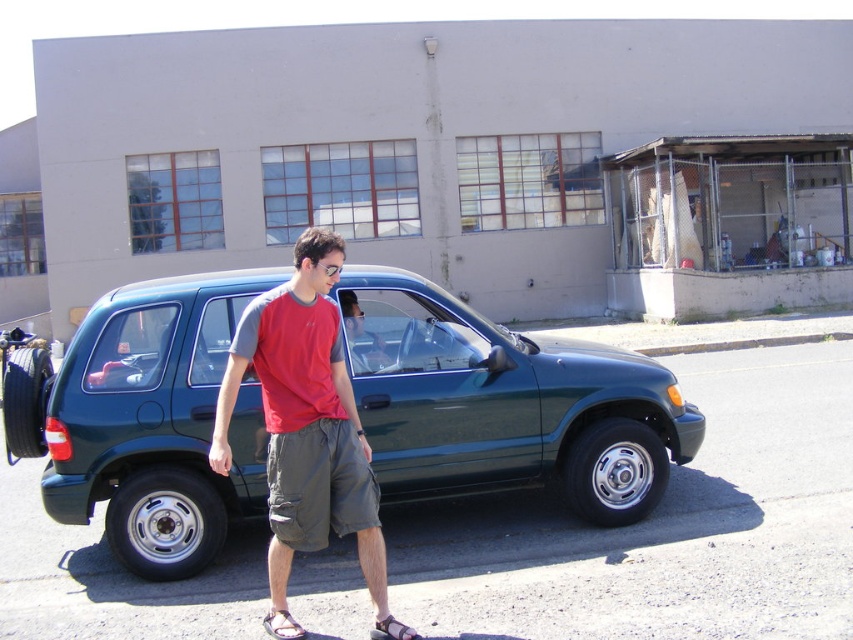
Measure the distance between purple fabric sandal at lower center and camera.

4.02 meters

Can you confirm if purple fabric sandal at lower center is bigger than brown leather sandal at lower center?

Indeed, purple fabric sandal at lower center has a larger size compared to brown leather sandal at lower center.

Who is more forward, (277, 612) or (395, 632)?

Positioned in front is point (395, 632).

Find the location of `purple fabric sandal at lower center`. purple fabric sandal at lower center is located at coordinates (282, 625).

Is matte red t-shirt at center positioned in front of brown leather sandal at lower center?

No, it is not.

Which is behind, point (212, 442) or point (395, 634)?

Positioned behind is point (212, 442).

Where is `matte red t-shirt at center`? Image resolution: width=853 pixels, height=640 pixels. matte red t-shirt at center is located at coordinates (305, 419).

Is green metallic minivan at center shorter than matte red t-shirt at center?

Result: Yes.

Is green metallic minivan at center taller than matte red t-shirt at center?

Incorrect, green metallic minivan at center's height is not larger of matte red t-shirt at center's.

Which is in front, point (550, 429) or point (321, 470)?

Point (321, 470)

The width and height of the screenshot is (853, 640). Identify the location of green metallic minivan at center. (503, 403).